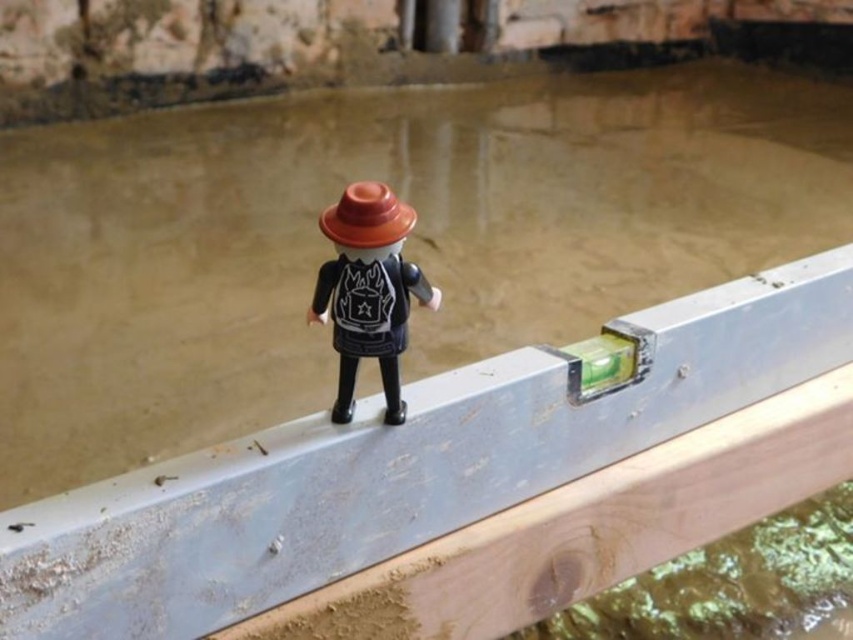
Who is more forward, (554, 417) or (398, 269)?

Point (398, 269) is more forward.

Where is `metal/wooden ledge at center`? The width and height of the screenshot is (853, 640). metal/wooden ledge at center is located at coordinates (402, 465).

Find the location of a particular element. metal/wooden ledge at center is located at coordinates (402, 465).

Is metal/wooden ledge at center smaller than matte orange cone at center?

No, metal/wooden ledge at center is not smaller than matte orange cone at center.

The width and height of the screenshot is (853, 640). What do you see at coordinates (402, 465) in the screenshot?
I see `metal/wooden ledge at center` at bounding box center [402, 465].

Is point (260, 448) positioned in front of point (357, 209)?

That is False.

Locate an element on the screen. The image size is (853, 640). metal/wooden ledge at center is located at coordinates (402, 465).

Who is positioned more to the right, matte black figure at center or matte orange cone at center?

Positioned to the right is matte black figure at center.

Can you confirm if matte black figure at center is shorter than matte orange cone at center?

In fact, matte black figure at center may be taller than matte orange cone at center.

What are the coordinates of `matte black figure at center` in the screenshot? It's located at (368, 291).

Where is `matte black figure at center`? Image resolution: width=853 pixels, height=640 pixels. matte black figure at center is located at coordinates (368, 291).